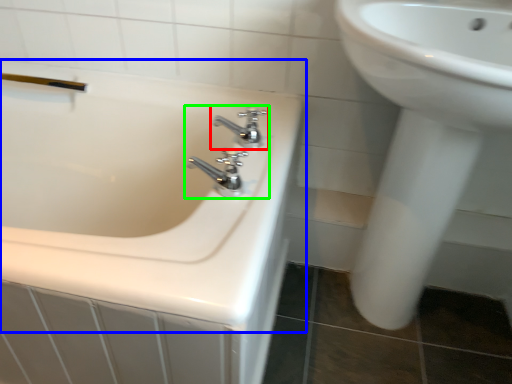
Question: Which is farther away from tap (highlighted by a red box)? bathtub (highlighted by a blue box) or tap (highlighted by a green box)?

Choices:
 (A) bathtub
 (B) tap

Answer: (A)